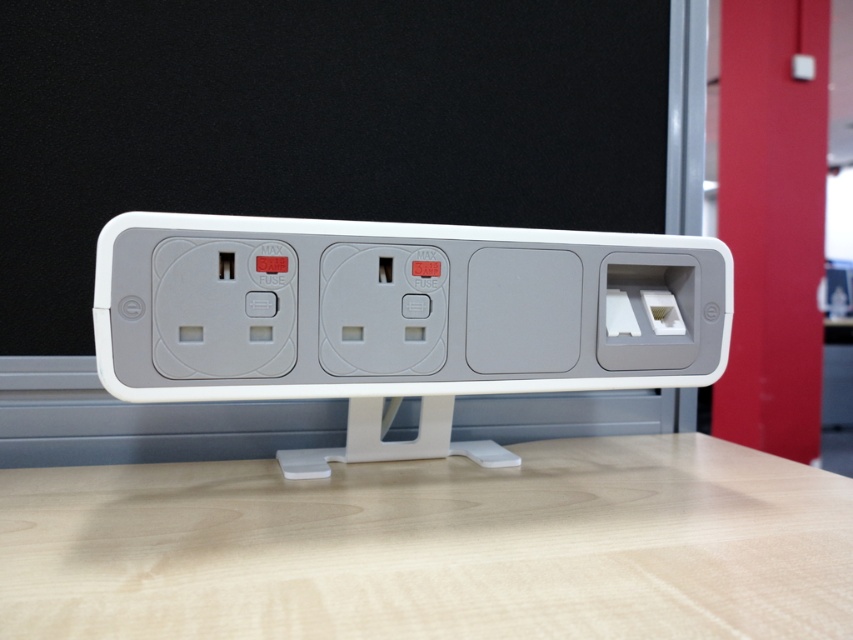
You have a power strip that needs to be placed on the light wood table at center. The power strip is 16 inches long. Will it fit entirely on the table without overhanging?

The light wood table at center has enough space since the distance between them is 17.76 inches, which is longer than the power strip length of 16 inches. It will fit.

You are setting up a new desk setup and want to place a laptop on the light wood table at center. However, you need to plug in the laptop charger into the white plastic power strip at center. Based on their positions, will the power strip be in a convenient location for plugging in the charger while using the laptop?

The light wood table at center is positioned under the white plastic power strip at center, meaning the power strip is likely mounted above the table. This placement might make it inconvenient to plug in the charger while using the laptop, as the strip would be out of easy reach.